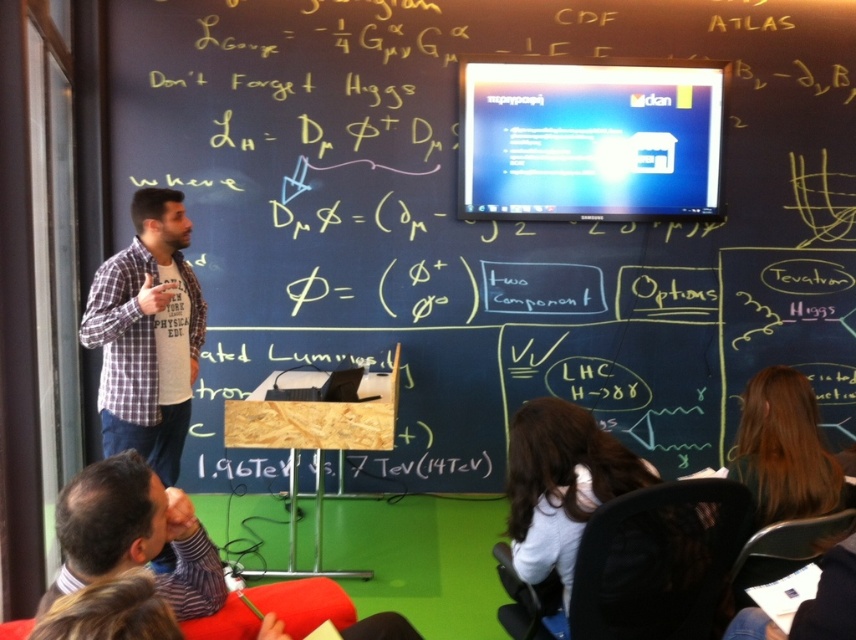
Image resolution: width=856 pixels, height=640 pixels. What do you see at coordinates (147, 333) in the screenshot?
I see `plaid shirt at left` at bounding box center [147, 333].

The width and height of the screenshot is (856, 640). In order to click on plaid shirt at left in this screenshot , I will do [x=147, y=333].

Does wooden podium at center have a greater height compared to dark brown leather jacket at lower left?

Yes, wooden podium at center is taller than dark brown leather jacket at lower left.

From the picture: Can you confirm if wooden podium at center is smaller than dark brown leather jacket at lower left?

No, wooden podium at center is not smaller than dark brown leather jacket at lower left.

What are the coordinates of `wooden podium at center` in the screenshot? It's located at (486, 224).

Find the location of a particular element. The height and width of the screenshot is (640, 856). wooden podium at center is located at coordinates (486, 224).

This screenshot has height=640, width=856. What do you see at coordinates (147, 333) in the screenshot?
I see `plaid shirt at left` at bounding box center [147, 333].

Is point (198, 337) positioned behind point (201, 564)?

Yes, point (198, 337) is behind point (201, 564).

Between point (137, 291) and point (189, 609), which one is positioned behind?

Point (137, 291)

Find the location of a particular element. Image resolution: width=856 pixels, height=640 pixels. plaid shirt at left is located at coordinates click(147, 333).